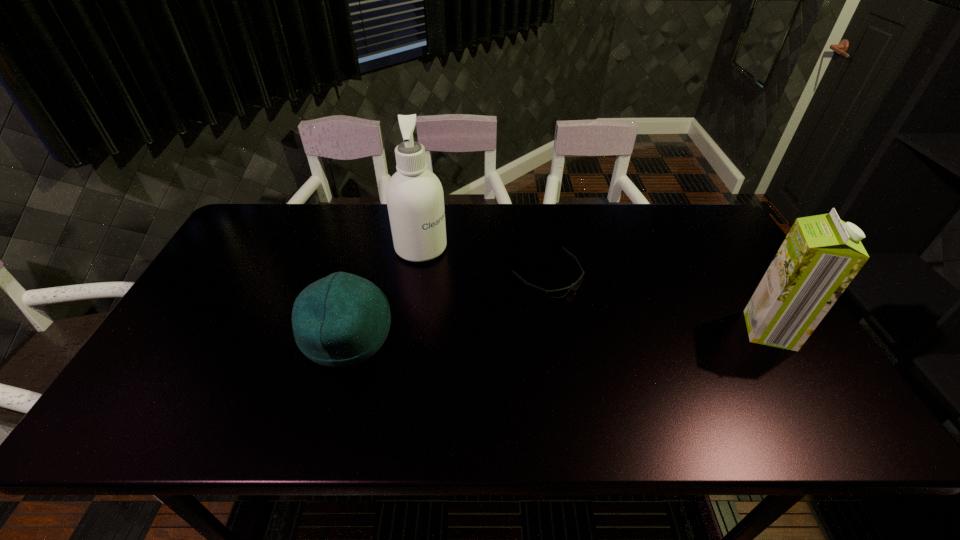
You are a GUI agent. You are given a task and a screenshot of the screen. Output one action in this format:
    pyautogui.click(x=<x>, y=<y>)
    Task: Click on the vacant space on the desktop that is between the second shortest object and the soya milk and is positioned on the front-facing side of the shortest object
    This screenshot has width=960, height=540.
    Given the screenshot: What is the action you would take?
    pyautogui.click(x=613, y=333)

This screenshot has width=960, height=540. I want to click on free space on the desktop that is between the beanie and the soya milk and is positioned on the front label of the cleansing agent, so click(603, 333).